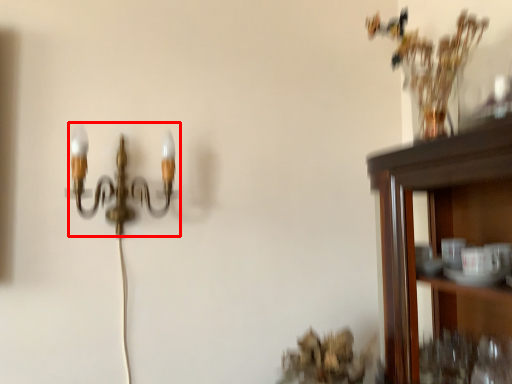
Question: From the image's perspective, considering the relative positions of lamp (annotated by the red box) and vase in the image provided, where is lamp (annotated by the red box) located with respect to the staircase?

Choices:
 (A) above
 (B) below

Answer: (B)